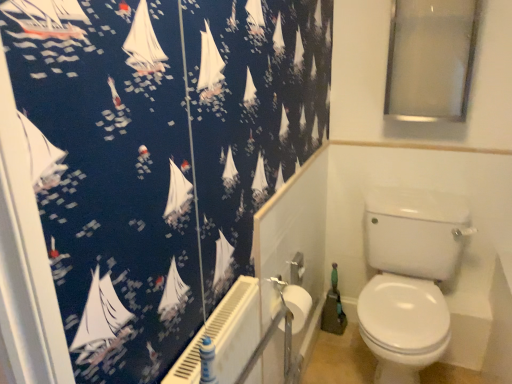
Question: Is white glossy toilet at lower right to the left of white plastic radiator at lower center from the viewer's perspective?

Choices:
 (A) no
 (B) yes

Answer: (A)

Question: Is white glossy toilet at lower right touching white plastic radiator at lower center?

Choices:
 (A) no
 (B) yes

Answer: (A)

Question: Is white glossy toilet at lower right bigger than white plastic radiator at lower center?

Choices:
 (A) no
 (B) yes

Answer: (B)

Question: Is white glossy toilet at lower right turned away from white plastic radiator at lower center?

Choices:
 (A) yes
 (B) no

Answer: (B)

Question: Is white glossy toilet at lower right located outside white plastic radiator at lower center?

Choices:
 (A) yes
 (B) no

Answer: (A)

Question: Considering the positions of transparent glass window screen at upper right and white glossy bidet at lower right in the image, is transparent glass window screen at upper right bigger or smaller than white glossy bidet at lower right?

Choices:
 (A) small
 (B) big

Answer: (A)

Question: Considering the positions of transparent glass window screen at upper right and white glossy bidet at lower right in the image, is transparent glass window screen at upper right wider or thinner than white glossy bidet at lower right?

Choices:
 (A) thin
 (B) wide

Answer: (A)

Question: From the image's perspective, is transparent glass window screen at upper right above or below white glossy bidet at lower right?

Choices:
 (A) above
 (B) below

Answer: (A)

Question: Is transparent glass window screen at upper right taller or shorter than white glossy bidet at lower right?

Choices:
 (A) short
 (B) tall

Answer: (B)

Question: Do you think white glossy toilet at lower right is within white glossy bidet at lower right, or outside of it?

Choices:
 (A) outside
 (B) inside

Answer: (A)

Question: Considering the positions of white glossy toilet at lower right and white glossy bidet at lower right in the image, is white glossy toilet at lower right wider or thinner than white glossy bidet at lower right?

Choices:
 (A) thin
 (B) wide

Answer: (B)

Question: In terms of height, does white glossy toilet at lower right look taller or shorter compared to white glossy bidet at lower right?

Choices:
 (A) short
 (B) tall

Answer: (B)

Question: Visually, is white glossy toilet at lower right positioned to the left or to the right of white glossy bidet at lower right?

Choices:
 (A) left
 (B) right

Answer: (A)

Question: From the image's perspective, is white plastic radiator at lower center located above or below white glossy toilet at lower right?

Choices:
 (A) below
 (B) above

Answer: (B)

Question: Would you say white plastic radiator at lower center is to the left or to the right of white glossy toilet at lower right in the picture?

Choices:
 (A) left
 (B) right

Answer: (A)